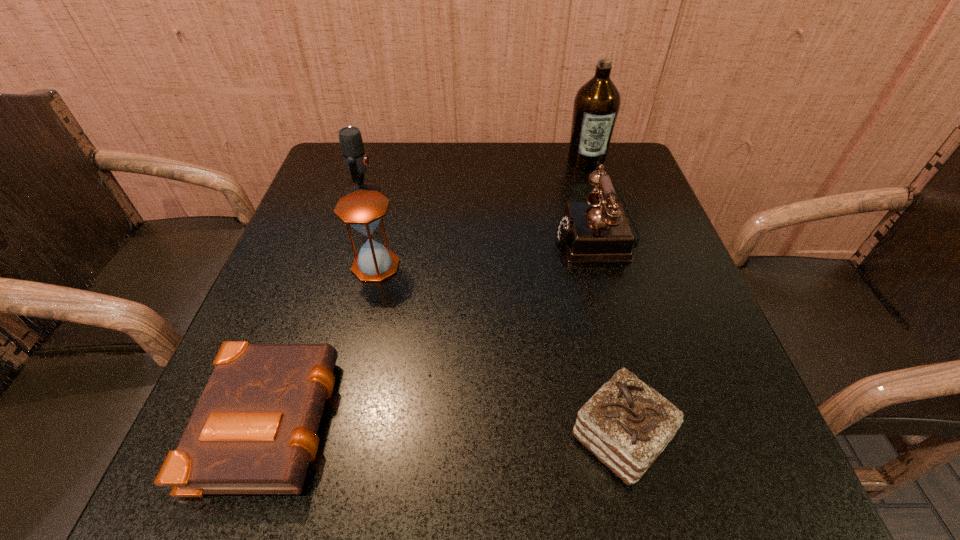
The image size is (960, 540). I want to click on the farthest object, so click(x=596, y=106).

You are a GUI agent. You are given a task and a screenshot of the screen. Output one action in this format:
    pyautogui.click(x=<x>, y=<y>)
    Task: Click on the tallest object
    Image resolution: width=960 pixels, height=540 pixels.
    Given the screenshot: What is the action you would take?
    pyautogui.click(x=596, y=106)

What are the coordinates of `the fifth nearest object` in the screenshot? It's located at (355, 159).

Locate an element on the screen. The image size is (960, 540). hourglass is located at coordinates (363, 209).

The height and width of the screenshot is (540, 960). I want to click on telephone, so click(597, 231).

Where is `chocolate cake`? The width and height of the screenshot is (960, 540). chocolate cake is located at coordinates (626, 424).

At what (x,y) coordinates should I click in order to perform the action: click on the shortest object. Please return your answer as a coordinate pair (x, y). The height and width of the screenshot is (540, 960). Looking at the image, I should click on (254, 429).

Where is `free location located on the label of the tallest object`? free location located on the label of the tallest object is located at coordinates (616, 258).

Locate an element on the screen. free region located 0.180m on the side of the fifth nearest object with the red ring is located at coordinates (454, 192).

I want to click on vacant space located 0.120m on the left of the hourglass, so click(x=294, y=266).